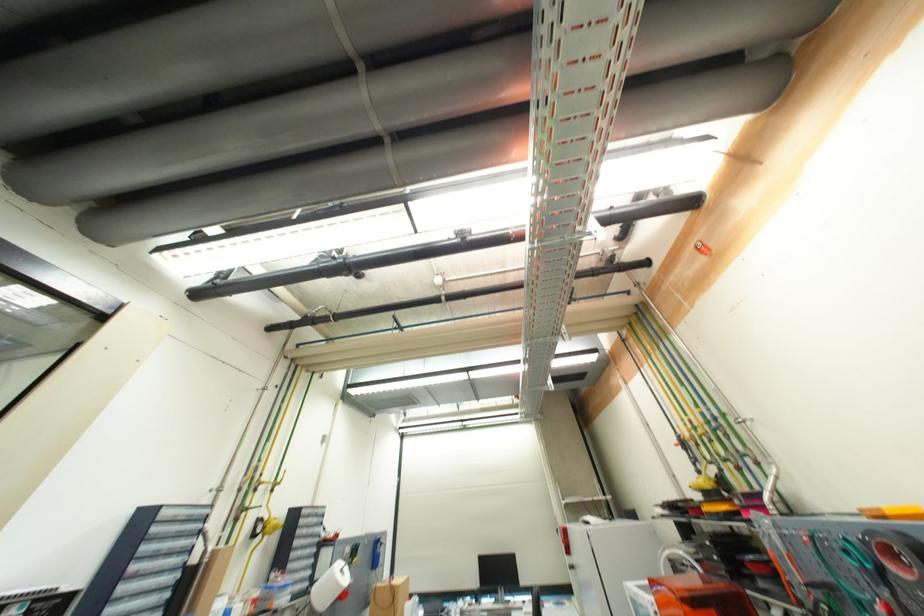
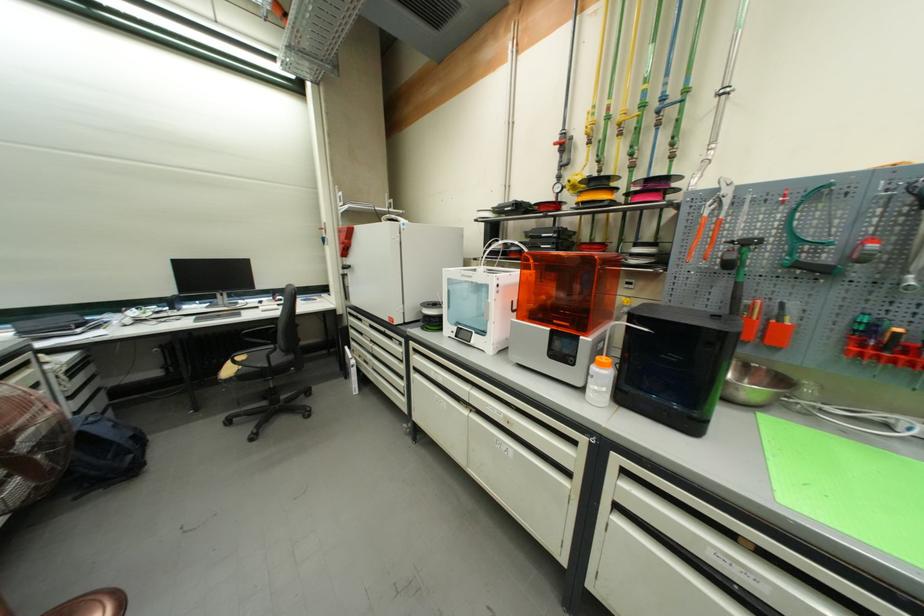
Find the pixel in the second image that matches the point at 773,541 in the first image.

(719, 208)